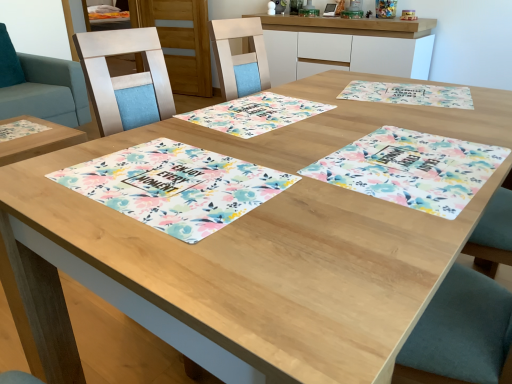
The height and width of the screenshot is (384, 512). In order to click on free space that is in between floral fabric placemat at center, the 1th place mat when ordered from left to right, and floral fabric placemat at upper right, which is the fourth place mat in left-to-right order in this screenshot , I will do `click(332, 132)`.